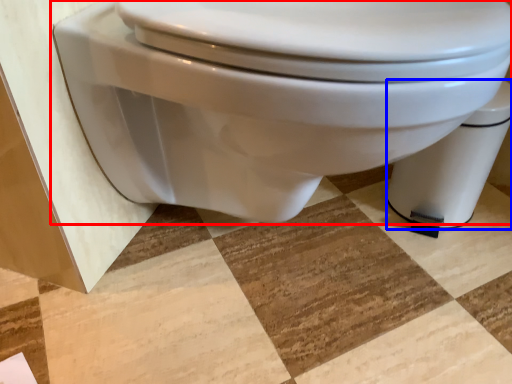
Question: Which of the following is the closest to the observer, toilet (highlighted by a red box) or toilet bowl (highlighted by a blue box)?

Choices:
 (A) toilet
 (B) toilet bowl

Answer: (A)